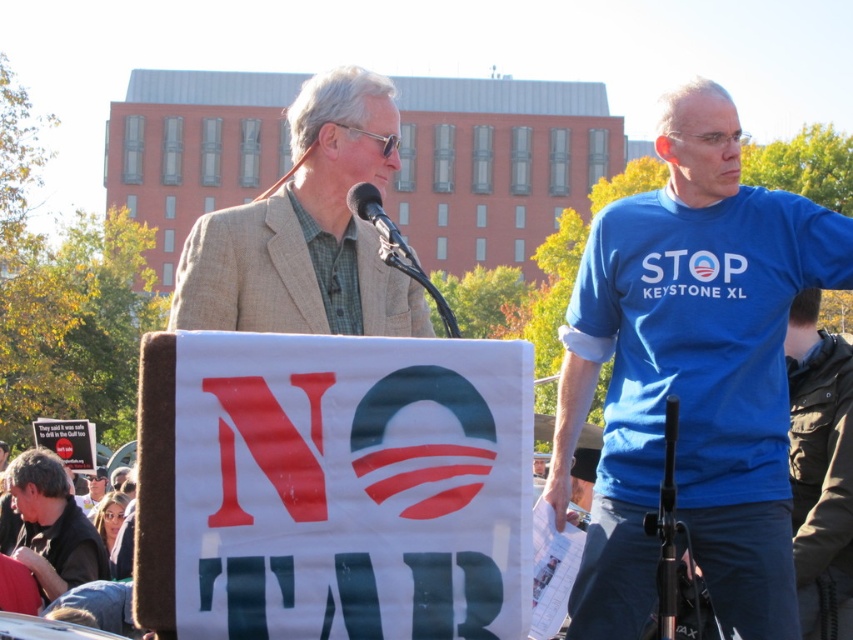
Can you confirm if dark brown leather jacket at lower right is positioned above dark brown leather jacket at lower left?

Yes.

Which is behind, point (819, 499) or point (21, 538)?

The point (21, 538) is behind.

Is point (842, 584) in front of point (26, 465)?

Yes, it is in front of point (26, 465).

Identify the location of dark brown leather jacket at lower right. Image resolution: width=853 pixels, height=640 pixels. (819, 465).

Can you confirm if beige textured blazer at center is positioned to the left of dark brown leather jacket at lower left?

No, beige textured blazer at center is not to the left of dark brown leather jacket at lower left.

Between point (316, 259) and point (57, 483), which one is positioned behind?

Positioned behind is point (57, 483).

At what (x,y) coordinates should I click in order to perform the action: click on beige textured blazer at center. Please return your answer as a coordinate pair (x, y). This screenshot has width=853, height=640. Looking at the image, I should click on (306, 230).

Consider the image. Who is more distant from viewer, (672, 208) or (387, 244)?

The point (672, 208) is more distant.

Where is `blue cotton t-shirt at right`? This screenshot has width=853, height=640. blue cotton t-shirt at right is located at coordinates (691, 376).

The image size is (853, 640). I want to click on blue cotton t-shirt at right, so click(x=691, y=376).